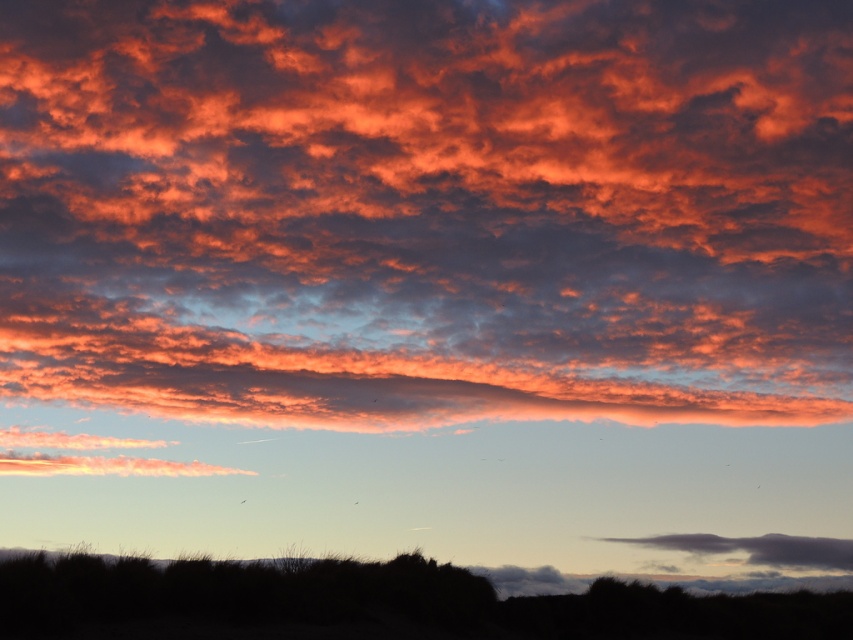
Question: Can you confirm if cloudy sky at upper center is positioned above dark gray cloud at lower right?

Choices:
 (A) yes
 (B) no

Answer: (A)

Question: Estimate the real-world distances between objects in this image. Which object is farther from the cloudy sky at upper center?

Choices:
 (A) dark gray cloud at lower right
 (B) silhouette grass at lower center

Answer: (B)

Question: Is silhouette grass at lower center closer to camera compared to dark gray cloud at lower right?

Choices:
 (A) yes
 (B) no

Answer: (A)

Question: Estimate the real-world distances between objects in this image. Which object is farther from the silhouette grass at lower center?

Choices:
 (A) dark gray cloud at lower right
 (B) cloudy sky at upper center

Answer: (B)

Question: Considering the relative positions of cloudy sky at upper center and silhouette grass at lower center in the image provided, where is cloudy sky at upper center located with respect to silhouette grass at lower center?

Choices:
 (A) below
 (B) above

Answer: (B)

Question: Which of the following is the closest to the observer?

Choices:
 (A) silhouette grass at lower center
 (B) dark gray cloud at lower right

Answer: (A)